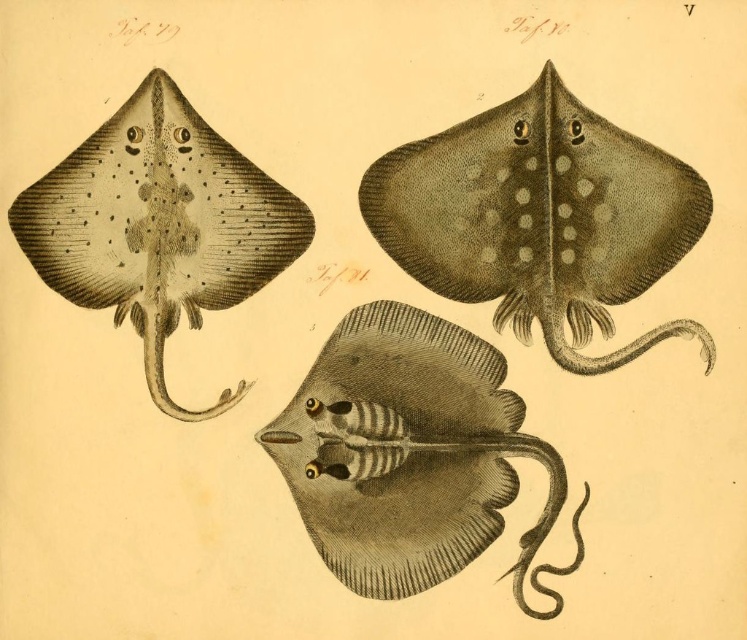
You are an art conservator examining a vintage scientific illustration of stingrays. The image includes a black textured stingray at upper left and another stingray at top right. Based on their positions, which stingray is closer to the center of the illustration?

The black textured stingray at upper left is positioned at point (x=158, y=225), making it closer to the center of the illustration compared to the other stingray at top right.

Looking at the two stingrays in the vintage illustration, the brown dotted stingray at upper right and the black textured stingray at upper left, which one is positioned more to the east if the image is oriented with north at the top?

The brown dotted stingray at upper right is positioned to the right of the black textured stingray at upper left. Since the image is oriented with north at the top, east would be to the right. Therefore, the brown dotted stingray at upper right is more to the east.

In the vintage scientific illustration of stingrays, there is a black textured stingray at upper left and a gray striped stingray at center. Which stingray is positioned to the right of the other?

The gray striped stingray at center is to the right of the black textured stingray at upper left.